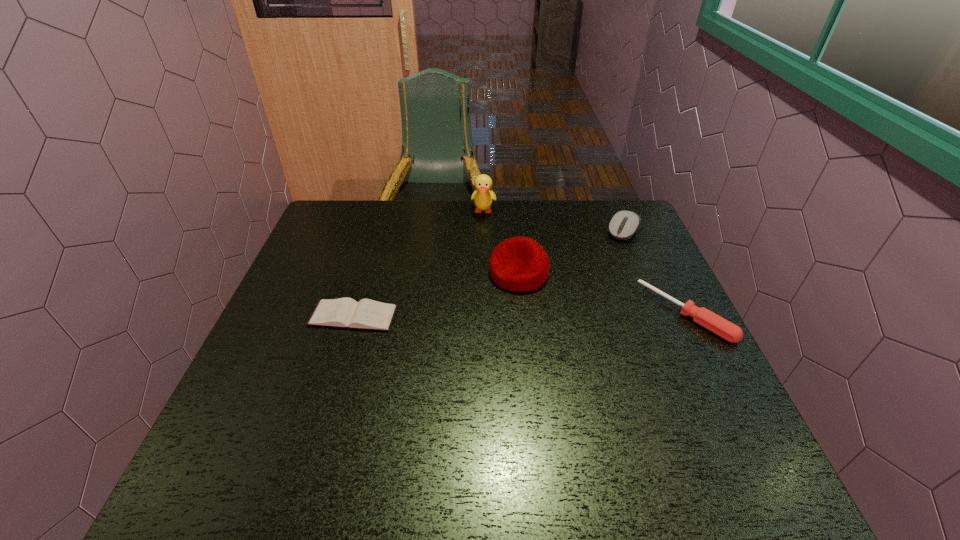
Locate an element on the screen. The height and width of the screenshot is (540, 960). the leftmost object is located at coordinates (367, 314).

Identify the location of the shortest object. The width and height of the screenshot is (960, 540). click(x=367, y=314).

Locate an element on the screen. This screenshot has height=540, width=960. screwdriver is located at coordinates (725, 329).

The image size is (960, 540). I want to click on the tallest object, so click(483, 197).

You are a GUI agent. You are given a task and a screenshot of the screen. Output one action in this format:
    pyautogui.click(x=<x>, y=<y>)
    Task: Click on the computer equipment
    
    Given the screenshot: What is the action you would take?
    pyautogui.click(x=623, y=225)

This screenshot has height=540, width=960. In order to click on beanbag in this screenshot , I will do `click(519, 264)`.

Locate an element on the screen. Image resolution: width=960 pixels, height=540 pixels. free space located on the back of the diary is located at coordinates (375, 244).

At what (x,y) coordinates should I click in order to perform the action: click on vacant area situated 0.160m on the front of the screwdriver. Please return your answer as a coordinate pair (x, y). This screenshot has height=540, width=960. Looking at the image, I should click on (731, 406).

Find the location of a particular element. The height and width of the screenshot is (540, 960). free location located 0.250m on the front-facing side of the duckling is located at coordinates (480, 272).

Identify the location of vacant point located on the front-facing side of the duckling. The width and height of the screenshot is (960, 540). (478, 301).